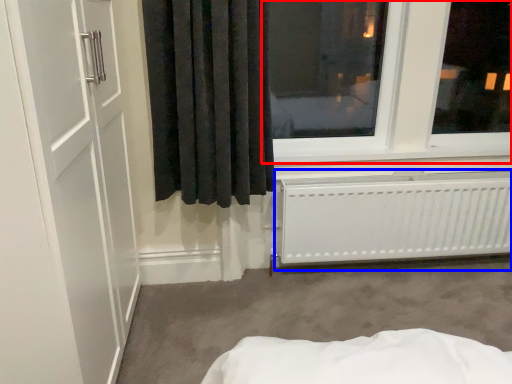
Question: Which object appears closest to the camera in this image, window (highlighted by a red box) or radiator (highlighted by a blue box)?

Choices:
 (A) window
 (B) radiator

Answer: (A)